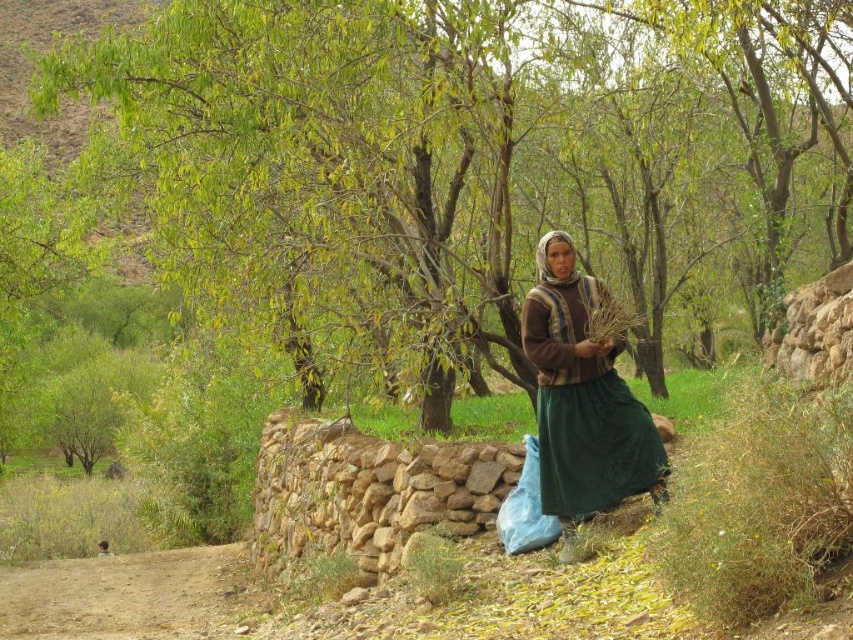
Question: Can you confirm if green leafy tree at center is smaller than brown woven scarf at center?

Choices:
 (A) yes
 (B) no

Answer: (B)

Question: Is green leafy tree at center smaller than brown woven scarf at center?

Choices:
 (A) no
 (B) yes

Answer: (A)

Question: Which object is closer to the camera taking this photo?

Choices:
 (A) green leafy tree at center
 (B) brown woven scarf at center

Answer: (B)

Question: Which point is closer to the camera?

Choices:
 (A) green leafy tree at center
 (B) brown woven scarf at center

Answer: (B)

Question: In this image, where is green leafy tree at center located relative to brown woven scarf at center?

Choices:
 (A) right
 (B) left

Answer: (B)